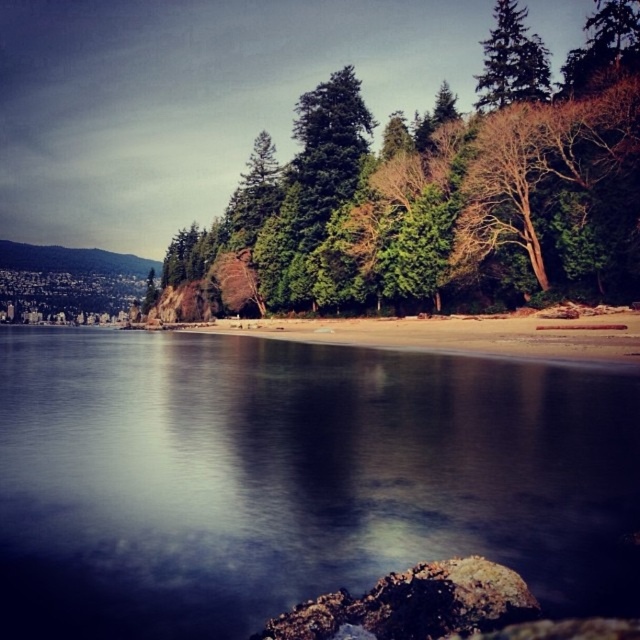
Does smooth dark water at center appear on the left side of green matte tree at upper right?

Yes, smooth dark water at center is to the left of green matte tree at upper right.

Is smooth dark water at center above green matte tree at upper right?

Actually, smooth dark water at center is below green matte tree at upper right.

Between point (108, 541) and point (545, 68), which one is positioned in front?

Point (108, 541) is more forward.

Find the location of a particular element. The image size is (640, 640). smooth dark water at center is located at coordinates (296, 477).

Between smooth dark water at center and rusty metallic rock at lower center, which one appears on the right side from the viewer's perspective?

From the viewer's perspective, rusty metallic rock at lower center appears more on the right side.

Who is higher up, smooth dark water at center or rusty metallic rock at lower center?

smooth dark water at center is higher up.

What are the coordinates of `smooth dark water at center` in the screenshot? It's located at (296, 477).

I want to click on smooth dark water at center, so click(296, 477).

Does green textured tree at center have a larger size compared to green matte tree at upper right?

Yes, green textured tree at center is bigger than green matte tree at upper right.

Between point (316, 131) and point (509, 67), which one is positioned behind?

Point (316, 131)

Which is behind, point (628, 3) or point (531, 61)?

Point (531, 61)

I want to click on green textured tree at center, so pyautogui.click(x=448, y=186).